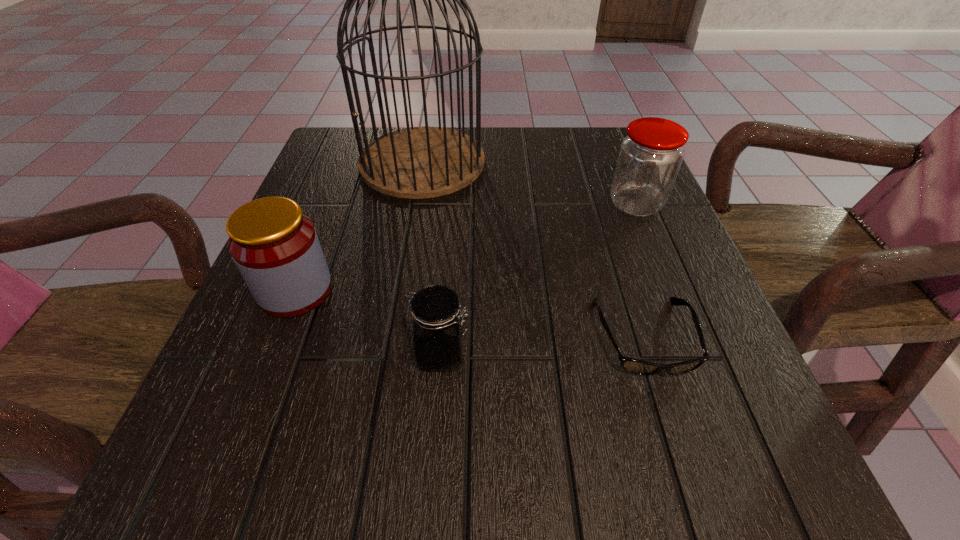
I want to click on the tallest object, so click(x=416, y=162).

You are a GUI agent. You are given a task and a screenshot of the screen. Output one action in this format:
    pyautogui.click(x=<x>, y=<y>)
    Task: Click on the rightmost jar
    The height and width of the screenshot is (540, 960).
    Given the screenshot: What is the action you would take?
    pyautogui.click(x=650, y=156)

Find the location of `the second nearest jar`. the second nearest jar is located at coordinates tap(275, 247).

What are the coordinates of `the nearest jar` in the screenshot? It's located at (438, 333).

Find the location of a particular element. The image size is (960, 540). the second jar from left to right is located at coordinates (438, 333).

Where is `spectacles`? The width and height of the screenshot is (960, 540). spectacles is located at coordinates (635, 366).

At what (x,y) coordinates should I click in order to perform the action: click on free space located 0.130m at the door of the tallest object. Please return your answer as a coordinate pair (x, y). The height and width of the screenshot is (540, 960). Looking at the image, I should click on (409, 238).

I want to click on vacant point located 0.150m on the back of the rightmost jar, so click(x=615, y=153).

Find the location of a particular element. This screenshot has height=540, width=960. free region located 0.380m on the back of the second farthest jar is located at coordinates click(348, 158).

Where is `free point located on the lid of the shortest jar`? free point located on the lid of the shortest jar is located at coordinates (553, 355).